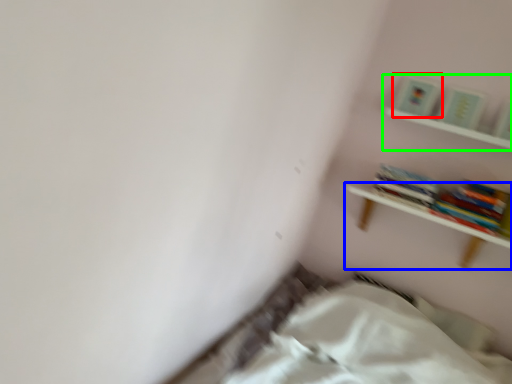
Question: Considering the real-world distances, which object is closest to paperback book (highlighted by a red box)? shelf (highlighted by a blue box) or shelf (highlighted by a green box).

Choices:
 (A) shelf
 (B) shelf

Answer: (B)